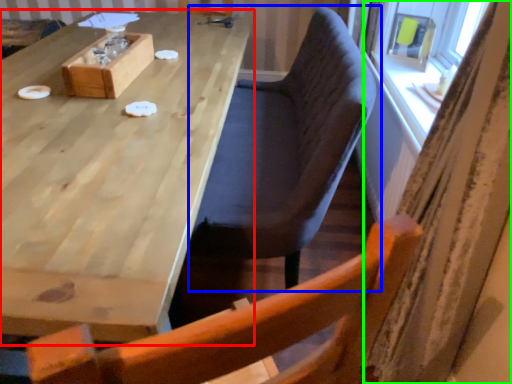
Question: Based on their relative distances, which object is farther from table (highlighted by a red box)? Choose from chair (highlighted by a blue box) and curtain (highlighted by a green box).

Choices:
 (A) chair
 (B) curtain

Answer: (B)